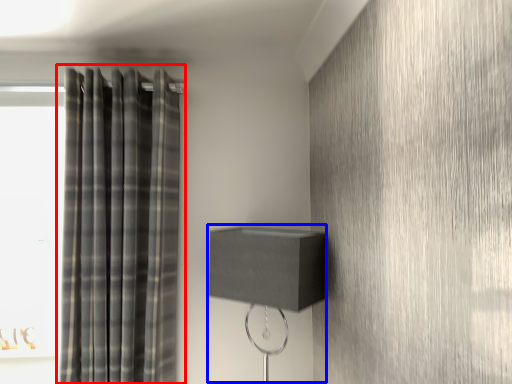
Question: Among these objects, which one is nearest to the camera, curtain (highlighted by a red box) or table lamp (highlighted by a blue box)?

Choices:
 (A) curtain
 (B) table lamp

Answer: (B)